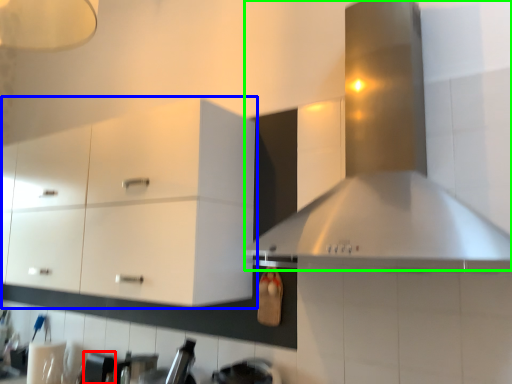
Question: Considering the real-world distances, which object is closest to appliance (highlighted by a red box)? cabinetry (highlighted by a blue box) or vent (highlighted by a green box).

Choices:
 (A) cabinetry
 (B) vent

Answer: (A)